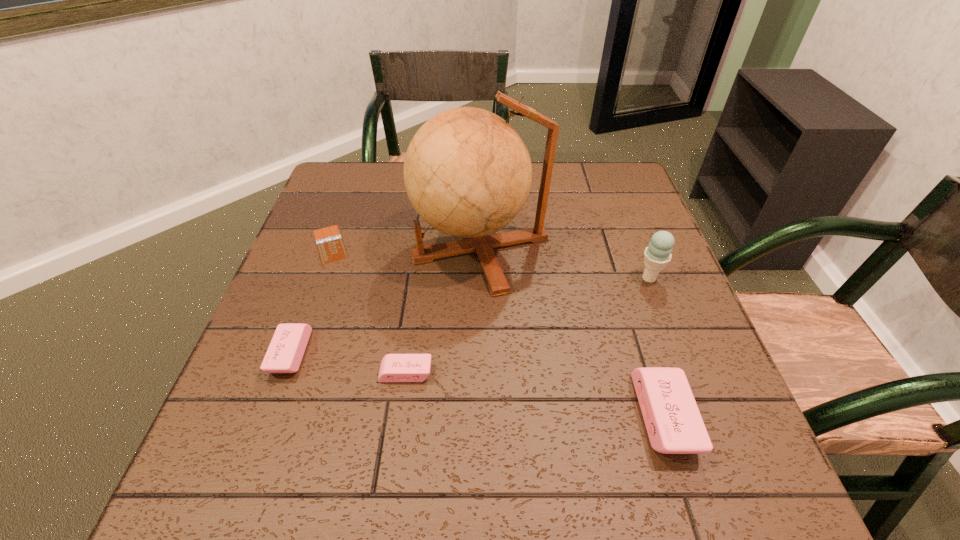
The image size is (960, 540). I want to click on free space located on the right of the second shortest object, so (468, 373).

The image size is (960, 540). Find the location of `vacant region located on the left of the tallest eraser`. vacant region located on the left of the tallest eraser is located at coordinates (434, 416).

I want to click on free space located 0.210m on the front of the fifth shortest object, so click(x=683, y=366).

The height and width of the screenshot is (540, 960). Identify the location of vacant point located 0.070m on the surface of the globe. (385, 247).

The image size is (960, 540). In order to click on vacant area located 0.150m on the surface of the globe in this screenshot , I will do `click(353, 247)`.

This screenshot has height=540, width=960. What are the coordinates of `free location located on the surface of the globe` in the screenshot? It's located at (365, 247).

Locate an element on the screen. Image resolution: width=960 pixels, height=540 pixels. vacant area located 0.310m on the front of the chocolate bar is located at coordinates (281, 378).

What are the coordinates of `object that is at the far edge` in the screenshot? It's located at (467, 173).

The width and height of the screenshot is (960, 540). Find the location of `object that is positioned at the near edge`. object that is positioned at the near edge is located at coordinates (674, 424).

Locate an element on the screen. This screenshot has height=540, width=960. eraser located in the left edge section of the desktop is located at coordinates (285, 352).